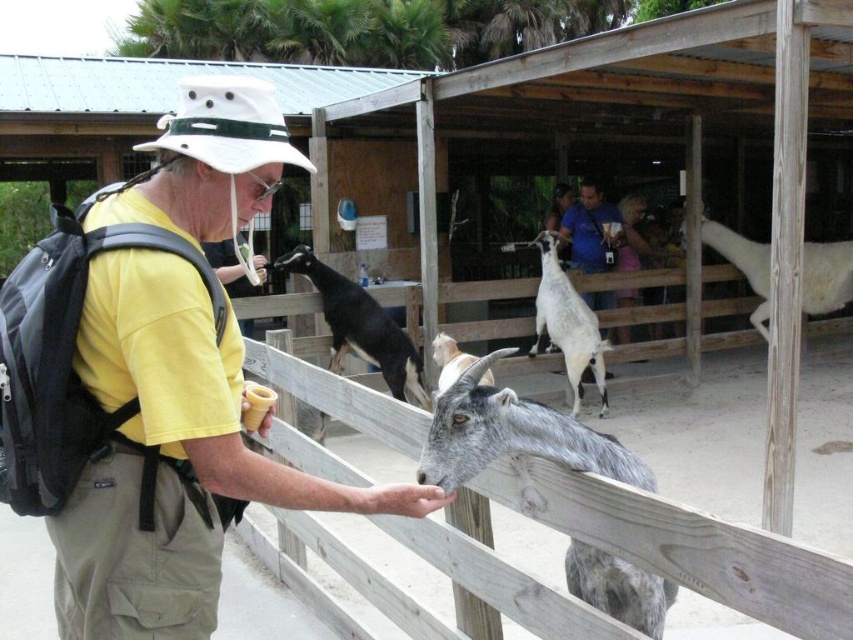
You are a visitor at the petting zoo and want to take a photo of the yellow cotton shirt at center and the black glossy goat at center. Which one should you zoom in on to ensure both are in focus?

The yellow cotton shirt at center is narrower than the black glossy goat at center, so you should zoom in on the goat to ensure both are in focus.

You are a visitor at the petting zoo and want to take a photo of the yellow cotton shirt at center and the black glossy goat at center. Which one should you focus on first to ensure both are in focus?

The yellow cotton shirt at center is closer to the viewer than the black glossy goat at center, so you should focus on the yellow cotton shirt at center first to ensure both are in focus.

You are standing at the entrance of the enclosure and want to locate the man in the yellow cotton shirt at center. According to the coordinates provided, where should you look relative to your current position?

The yellow cotton shirt at center is located at coordinates point 0.598 on the x axis and 0.210 on the y axis, so you should look to the right and slightly downward from your current position at the entrance.